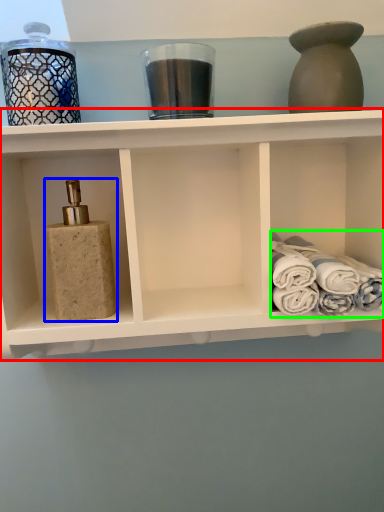
Question: Which is nearer to the shelf (highlighted by a red box)? toiletry (highlighted by a blue box) or bath towel (highlighted by a green box).

Choices:
 (A) toiletry
 (B) bath towel

Answer: (A)